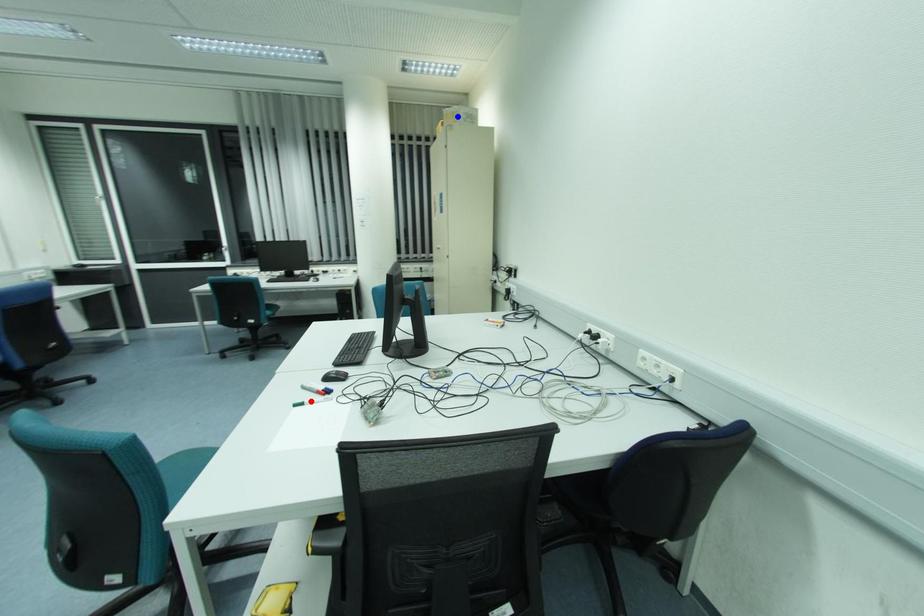
Question: Two points are marked on the image. Which point is closer to the camera?

Choices:
 (A) Blue point is closer.
 (B) Red point is closer.

Answer: (B)